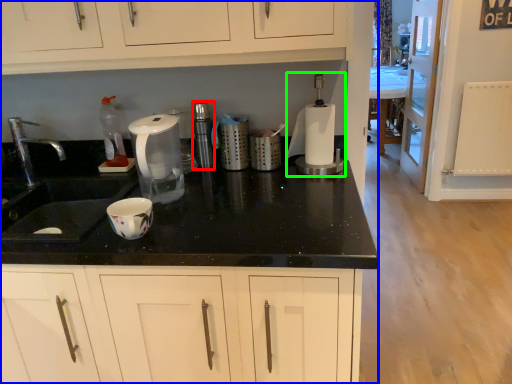
Question: Which object is positioned farthest from appliance (highlighted by a red box)? Select from dresser (highlighted by a blue box) and blender (highlighted by a green box).

Choices:
 (A) dresser
 (B) blender

Answer: (A)